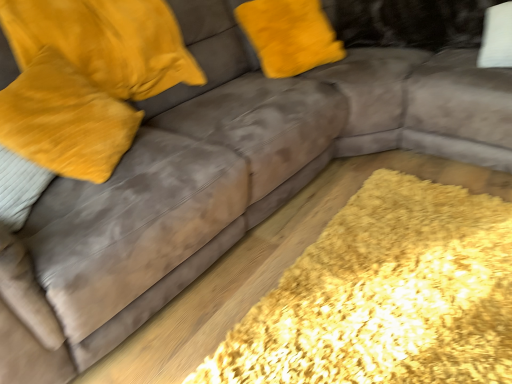
Find the location of a particular element. This screenshot has width=512, height=384. free space below yellow shaggy rug at lower right (from a real-world perspective) is located at coordinates (365, 293).